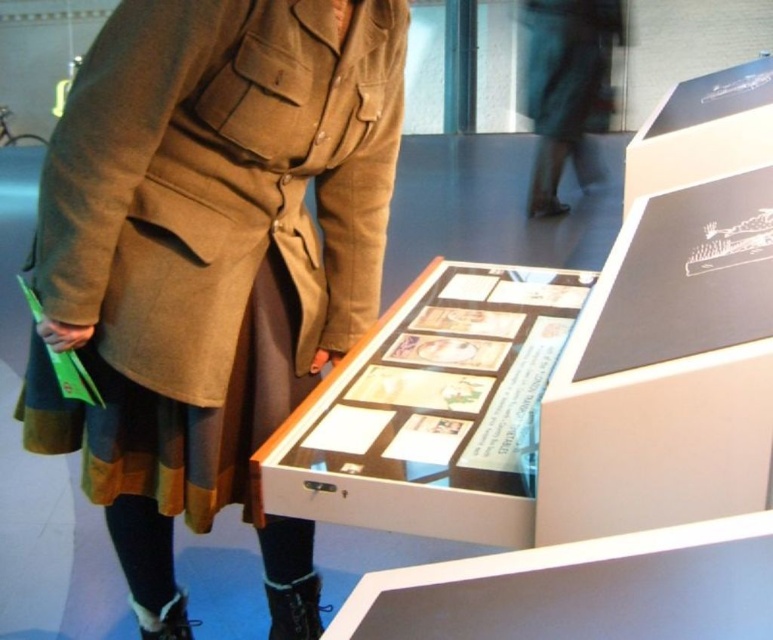
Does khaki woolen coat at center have a lesser width compared to dark green fabric coat at upper center?

Yes, khaki woolen coat at center is thinner than dark green fabric coat at upper center.

Locate an element on the screen. The image size is (773, 640). khaki woolen coat at center is located at coordinates (220, 179).

Which is behind, point (111, 326) or point (543, 106)?

The point (543, 106) is more distant.

This screenshot has width=773, height=640. I want to click on khaki woolen coat at center, so click(x=220, y=179).